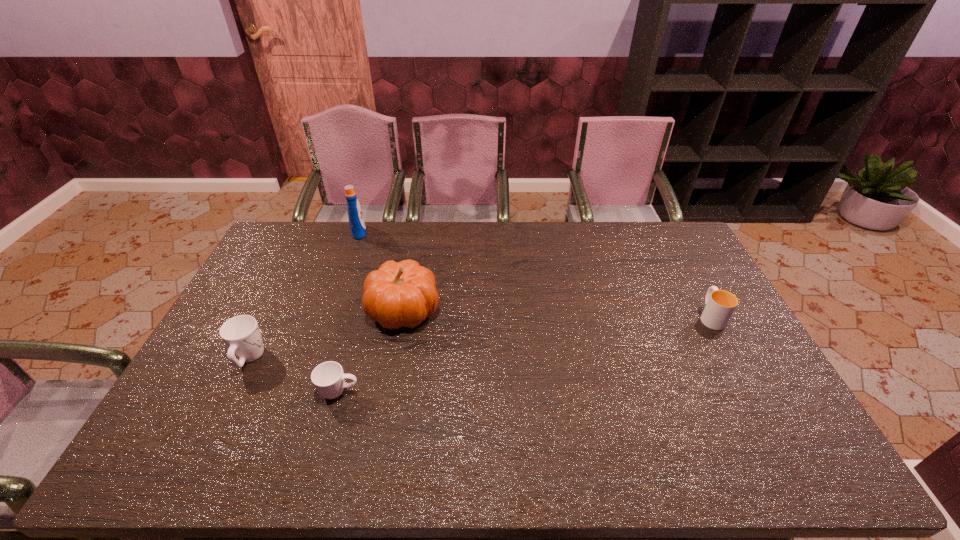
The height and width of the screenshot is (540, 960). Find the location of `object that is at the right edge`. object that is at the right edge is located at coordinates (720, 305).

In the image, there is a desktop. Where is `free space at the far edge`? free space at the far edge is located at coordinates click(448, 239).

The height and width of the screenshot is (540, 960). I want to click on free space at the near edge of the desktop, so click(728, 456).

Identify the location of vacant space at the left edge of the desktop. This screenshot has width=960, height=540. pyautogui.click(x=285, y=307).

Find the location of a particular element. vacant area at the right edge is located at coordinates (777, 433).

In the image, there is a desktop. Where is `vacant space at the far right corner`? The height and width of the screenshot is (540, 960). vacant space at the far right corner is located at coordinates click(x=660, y=235).

At what (x,y) coordinates should I click in order to perform the action: click on free space between the farther cup and the nearer cup. Please return your answer as a coordinate pair (x, y). The width and height of the screenshot is (960, 540). Looking at the image, I should click on (525, 354).

Where is `vacant point located between the pumpkin and the mug`? The height and width of the screenshot is (540, 960). vacant point located between the pumpkin and the mug is located at coordinates (326, 334).

This screenshot has width=960, height=540. I want to click on vacant region between the nearest object and the farther cup, so click(525, 354).

The height and width of the screenshot is (540, 960). In order to click on free space between the rightmost object and the pumpkin in this screenshot , I will do `click(557, 313)`.